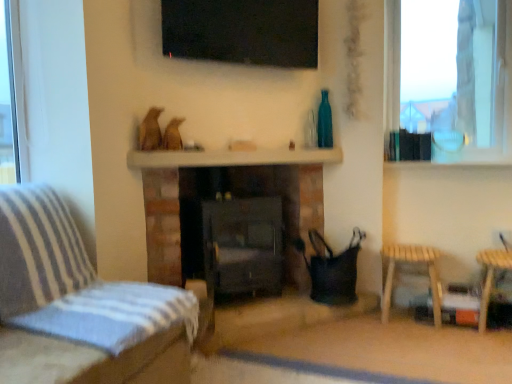
This screenshot has height=384, width=512. Describe the element at coordinates (242, 31) in the screenshot. I see `black glass tv at upper center` at that location.

Image resolution: width=512 pixels, height=384 pixels. Describe the element at coordinates (411, 261) in the screenshot. I see `light wood stool at lower right` at that location.

Locate an element on the screen. The width and height of the screenshot is (512, 384). white glossy mantle at center is located at coordinates (232, 158).

What is the approximate width of wooden stool at lower right?

It is 14.28 inches.

You are a GUI agent. You are given a task and a screenshot of the screen. Output one action in this format:
    pyautogui.click(x=<x>, y=<y>)
    Task: Click on the striped fabric couch at left
    The image size is (512, 384).
    Given the screenshot: What is the action you would take?
    pyautogui.click(x=80, y=290)

Does light wood stool at lower right turn towards white glossy mantle at center?

No, light wood stool at lower right does not turn towards white glossy mantle at center.

In the image, is light wood stool at lower right on the left side or the right side of white glossy mantle at center?

In the image, light wood stool at lower right appears on the right side of white glossy mantle at center.

Considering the relative sizes of light wood stool at lower right and white glossy mantle at center in the image provided, is light wood stool at lower right thinner than white glossy mantle at center?

In fact, light wood stool at lower right might be wider than white glossy mantle at center.

Which object is further away from the camera taking this photo, light wood stool at lower right or white glossy mantle at center?

light wood stool at lower right is further from the camera.

From the image's perspective, is transparent glass window at upper right above striped fabric couch at left?

Indeed, from the image's perspective, transparent glass window at upper right is shown above striped fabric couch at left.

Is transparent glass window at upper right with striped fabric couch at left?

No, transparent glass window at upper right is not beside striped fabric couch at left.

In the scene shown: Is transparent glass window at upper right taller or shorter than striped fabric couch at left?

transparent glass window at upper right is taller than striped fabric couch at left.

Could you tell me if transparent glass window at upper right is facing striped fabric couch at left?

No.

Does teal glass bottle at upper right have a greater height compared to striped fabric couch at left?

No, teal glass bottle at upper right is not taller than striped fabric couch at left.

Can you confirm if teal glass bottle at upper right is bigger than striped fabric couch at left?

No.

In the image, there is a striped fabric couch at left. Where is `bottle above it (from the image's perspective)`? bottle above it (from the image's perspective) is located at coordinates (324, 122).

Visually, is light wood stool at lower right positioned to the left or to the right of wooden stool at lower right?

Based on their positions, light wood stool at lower right is located to the left of wooden stool at lower right.

From the image's perspective, is light wood stool at lower right located above or below wooden stool at lower right?

light wood stool at lower right is below wooden stool at lower right.

Is there a large distance between light wood stool at lower right and wooden stool at lower right?

No, light wood stool at lower right is not far away from wooden stool at lower right.

From a real-world perspective, is transparent glass window at upper right physically located above or below teal glass bottle at upper right?

transparent glass window at upper right is situated higher than teal glass bottle at upper right in the real world.

What's the angular difference between transparent glass window at upper right and teal glass bottle at upper right's facing directions?

The facing directions of transparent glass window at upper right and teal glass bottle at upper right are 43.9 degrees apart.

Could you tell me if transparent glass window at upper right is turned towards teal glass bottle at upper right?

No, transparent glass window at upper right is not aimed at teal glass bottle at upper right.

Considering the sizes of objects transparent glass window at upper right and teal glass bottle at upper right in the image provided, who is taller, transparent glass window at upper right or teal glass bottle at upper right?

With more height is transparent glass window at upper right.

Visually, is black glass tv at upper center positioned to the left or to the right of striped fabric couch at left?

Clearly, black glass tv at upper center is on the right of striped fabric couch at left in the image.

Can you confirm if black glass tv at upper center is bigger than striped fabric couch at left?

No.

Is black glass tv at upper center touching striped fabric couch at left?

No, black glass tv at upper center is not with striped fabric couch at left.

How different are the orientations of black glass tv at upper center and striped fabric couch at left in degrees?

There is a 43.5-degree angle between the facing directions of black glass tv at upper center and striped fabric couch at left.

Considering the positions of objects teal glass bottle at upper right and matte black stove at center in the image provided, who is behind, teal glass bottle at upper right or matte black stove at center?

teal glass bottle at upper right is behind.

From the picture: From the image's perspective, which is above, teal glass bottle at upper right or matte black stove at center?

teal glass bottle at upper right, from the image's perspective.

Does teal glass bottle at upper right touch matte black stove at center?

They are not placed beside each other.

The width and height of the screenshot is (512, 384). I want to click on table below the white glossy mantle at center (from the image's perspective), so click(411, 261).

You are a GUI agent. You are given a task and a screenshot of the screen. Output one action in this format:
    pyautogui.click(x=<x>, y=<y>)
    Task: Click on the studio couch in front of the transparent glass window at upper right
    The image size is (512, 384).
    Given the screenshot: What is the action you would take?
    pyautogui.click(x=80, y=290)

Which object lies further to the anchor point striped fabric couch at left, transparent glass window at upper right or black glass tv at upper center?

transparent glass window at upper right is further to striped fabric couch at left.

Estimate the real-world distances between objects in this image. Which object is further from matte black stove at center, black glass tv at upper center or light wood stool at lower right?

black glass tv at upper center.

When comparing their distances from transparent glass window at upper right, does striped fabric couch at left or black glass tv at upper center seem closer?

black glass tv at upper center is closer to transparent glass window at upper right.

When comparing their distances from white glossy mantle at center, does teal glass bottle at upper right or light wood stool at lower right seem closer?

Based on the image, teal glass bottle at upper right appears to be nearer to white glossy mantle at center.

Estimate the real-world distances between objects in this image. Which object is closer to striped fabric couch at left, teal glass bottle at upper right or black glass tv at upper center?

The object closer to striped fabric couch at left is black glass tv at upper center.

Which object lies nearer to the anchor point black glass tv at upper center, matte black stove at center or white glossy mantle at center?

Among the two, white glossy mantle at center is located nearer to black glass tv at upper center.

When comparing their distances from matte black stove at center, does wooden stool at lower right or transparent glass window at upper right seem further?

Among the two, transparent glass window at upper right is located further to matte black stove at center.

Estimate the real-world distances between objects in this image. Which object is further from matte black stove at center, transparent glass window at upper right or white glossy mantle at center?

Based on the image, transparent glass window at upper right appears to be further to matte black stove at center.

Where is `mantle between black glass tv at upper center and wooden stool at lower right from left to right`? The width and height of the screenshot is (512, 384). mantle between black glass tv at upper center and wooden stool at lower right from left to right is located at coordinates (232, 158).

You are a GUI agent. You are given a task and a screenshot of the screen. Output one action in this format:
    pyautogui.click(x=<x>, y=<y>)
    Task: Click on the mantle situated between striped fabric couch at left and light wood stool at lower right from left to right
    
    Given the screenshot: What is the action you would take?
    (x=232, y=158)

Find the location of a particular element. The width and height of the screenshot is (512, 384). entertainment center between black glass tv at upper center and light wood stool at lower right from top to bottom is located at coordinates (243, 245).

The image size is (512, 384). I want to click on mantle that lies between black glass tv at upper center and matte black stove at center from top to bottom, so click(x=232, y=158).